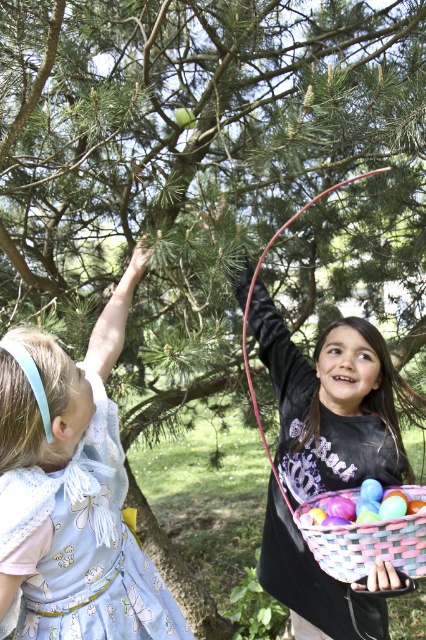
From the picture: Which is above, green pine tree at upper center or pastel woven basket at lower center?

green pine tree at upper center is above.

Between point (187, 124) and point (356, 522), which one is positioned in front?

Positioned in front is point (356, 522).

Locate an element on the screen. Image resolution: width=426 pixels, height=640 pixels. green pine tree at upper center is located at coordinates (207, 172).

Between light blue fabric dress at upper left and black matte shirt at upper center, which one is positioned higher?

light blue fabric dress at upper left is above.

Is light blue fabric dress at upper left further to the viewer compared to black matte shirt at upper center?

No, it is not.

Identify the location of light blue fabric dress at upper left. (71, 492).

Describe the element at coordinates (207, 172) in the screenshot. I see `green pine tree at upper center` at that location.

Is green pine tree at upper center thinner than black matte shirt at upper center?

No.

Is point (155, 115) farther from camera compared to point (363, 400)?

Yes.

You are a GUI agent. You are given a task and a screenshot of the screen. Output one action in this format:
    pyautogui.click(x=<x>, y=<y>)
    Task: Click on the green pine tree at upper center
    Image resolution: width=426 pixels, height=640 pixels.
    Given the screenshot: What is the action you would take?
    pyautogui.click(x=207, y=172)